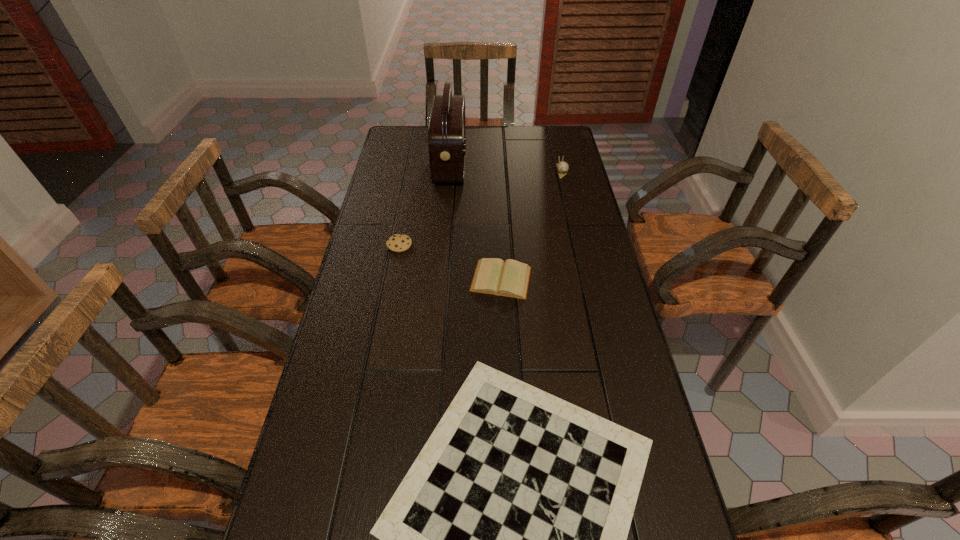
Identify the location of object that is at the far edge. The image size is (960, 540). (447, 131).

Locate an element on the screen. object that is at the left edge is located at coordinates (398, 242).

The image size is (960, 540). Identify the location of object present at the right edge. (562, 167).

In the image, there is a desktop. Find the location of `vacant space at the far edge`. vacant space at the far edge is located at coordinates (483, 154).

This screenshot has height=540, width=960. Identify the location of free space at the left edge. (390, 193).

Find the location of a particular element. Image resolution: width=960 pixels, height=540 pixels. free space at the right edge of the desktop is located at coordinates (625, 373).

In the image, there is a desktop. Identify the location of vacant space at the far right corner. (533, 130).

The height and width of the screenshot is (540, 960). I want to click on free area in between the escargot and the radio receiver, so click(506, 168).

At what (x,y) coordinates should I click in order to perform the action: click on unoccupied position between the escargot and the third farthest object. Please return your answer as a coordinate pair (x, y). The height and width of the screenshot is (540, 960). Looking at the image, I should click on (480, 208).

Where is `free space between the second tallest object and the radio receiver`? This screenshot has width=960, height=540. free space between the second tallest object and the radio receiver is located at coordinates (506, 168).